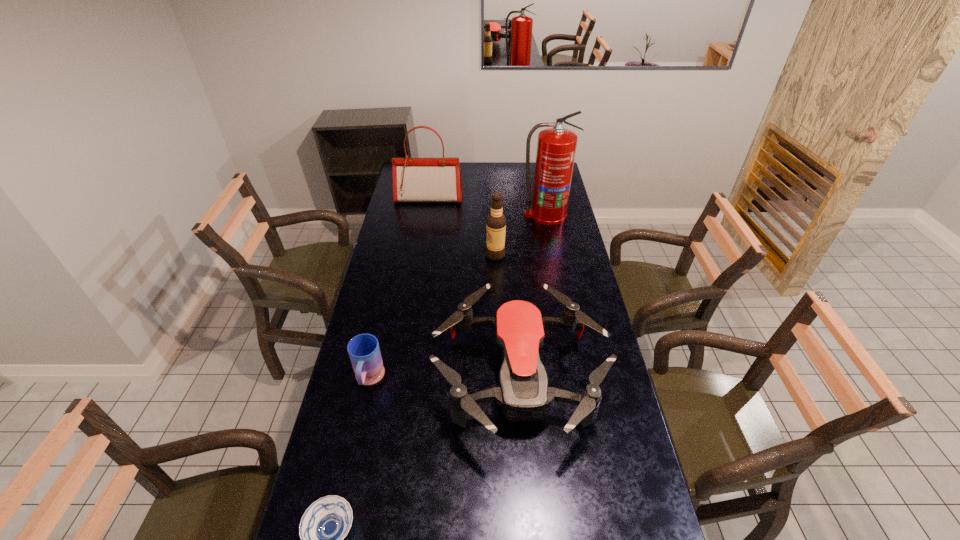
In the image, there is a desktop. Where is `vacant space at the left edge`? Image resolution: width=960 pixels, height=540 pixels. vacant space at the left edge is located at coordinates [x=372, y=458].

At what (x,y) coordinates should I click in order to perform the action: click on vacant region at the right edge of the desktop. Please return your answer as a coordinate pair (x, y). The width and height of the screenshot is (960, 540). Looking at the image, I should click on (589, 307).

At what (x,y) coordinates should I click in order to perform the action: click on free space that is in between the fourth tallest object and the mug. Please return your answer as a coordinate pair (x, y). The height and width of the screenshot is (540, 960). Looking at the image, I should click on (444, 379).

Locate an element on the screen. The image size is (960, 540). free space between the drone and the fifth tallest object is located at coordinates (444, 379).

I want to click on free spot between the farthest object and the mug, so click(x=398, y=289).

The height and width of the screenshot is (540, 960). Find the location of `vacant point located between the mug and the farthest object`. vacant point located between the mug and the farthest object is located at coordinates (398, 289).

Find the location of `the second closest object to the drone`. the second closest object to the drone is located at coordinates (326, 522).

Locate an element on the screen. Image resolution: width=960 pixels, height=540 pixels. object that stands as the fourth closest to the second farthest object is located at coordinates (364, 351).